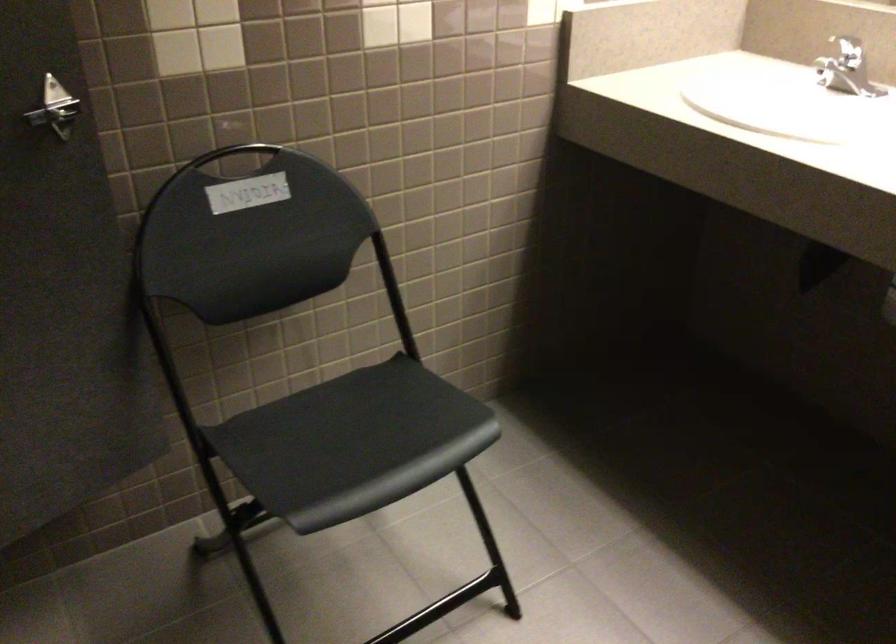
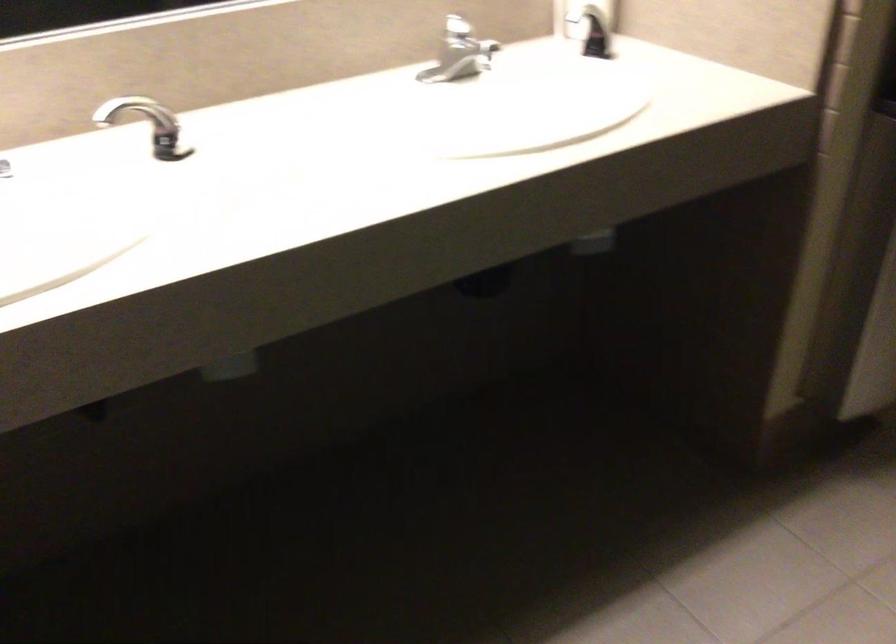
First-person continuous shooting, in which direction is the camera rotating?

The camera rotated toward right-down.